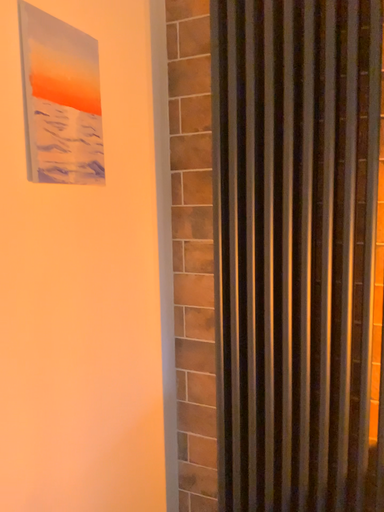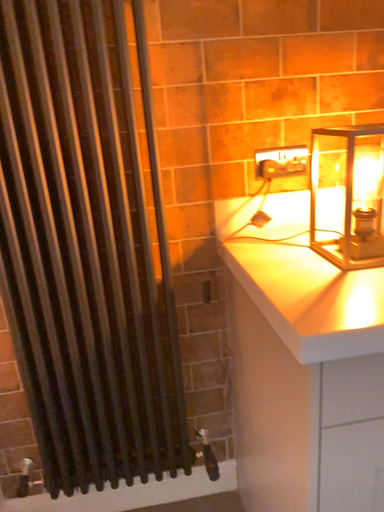
Question: How did the camera likely rotate when shooting the video?

Choices:
 (A) rotated left
 (B) rotated right

Answer: (B)